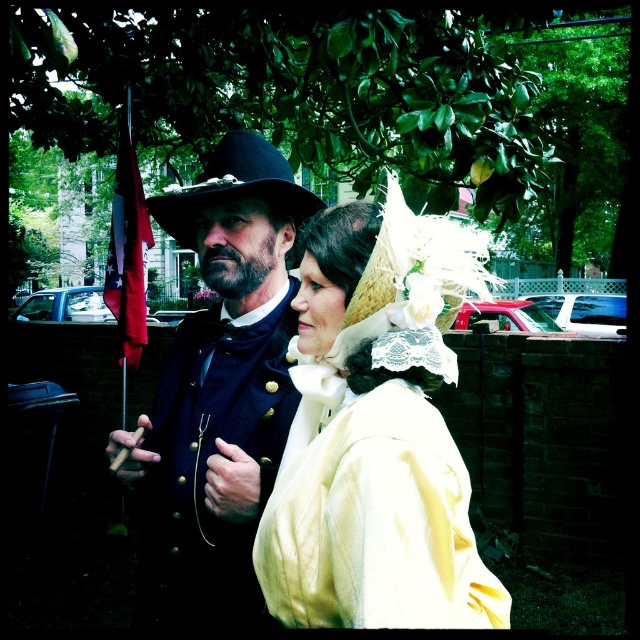
Question: Can you confirm if matte white lace bonnet at center is positioned to the right of matte black hat at center?

Choices:
 (A) yes
 (B) no

Answer: (A)

Question: Is the position of matte white lace bonnet at center less distant than that of black felt dress hat at upper center?

Choices:
 (A) yes
 (B) no

Answer: (A)

Question: Considering the real-world distances, which object is closest to the black felt dress hat at upper center?

Choices:
 (A) matte white lace bonnet at center
 (B) matte black hat at center

Answer: (B)

Question: Estimate the real-world distances between objects in this image. Which object is closer to the matte white lace bonnet at center?

Choices:
 (A) matte black hat at center
 (B) black felt dress hat at upper center

Answer: (A)

Question: Where is matte black hat at center located in relation to black felt dress hat at upper center in the image?

Choices:
 (A) below
 (B) above

Answer: (A)

Question: Based on their relative distances, which object is farther from the black felt dress hat at upper center?

Choices:
 (A) matte black hat at center
 (B) matte white lace bonnet at center

Answer: (B)